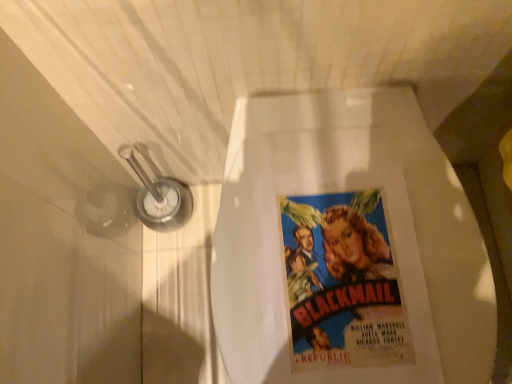
This screenshot has width=512, height=384. What do you see at coordinates (389, 219) in the screenshot?
I see `matte paper poster at center` at bounding box center [389, 219].

What is the approximate height of matte paper poster at center?

matte paper poster at center is 28.62 centimeters in height.

Locate an element on the screen. matte paper poster at center is located at coordinates (389, 219).

The width and height of the screenshot is (512, 384). In order to click on matte paper poster at center in this screenshot , I will do (x=389, y=219).